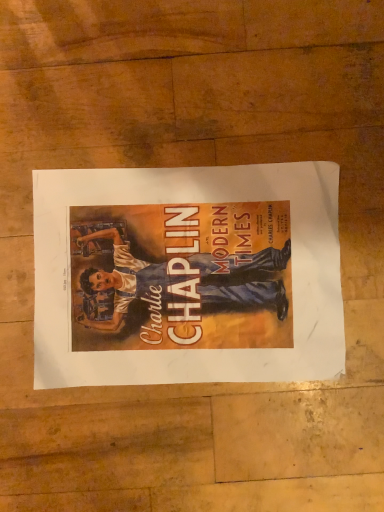
This screenshot has height=512, width=384. In order to click on free space above denim poster at center (from a real-world perspective) in this screenshot , I will do `click(188, 276)`.